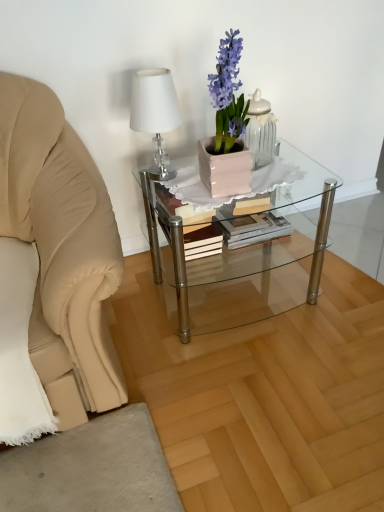
Locate an element on the screen. The image size is (384, 512). clear glass coffee table at center is located at coordinates click(245, 253).

The height and width of the screenshot is (512, 384). Describe the element at coordinates (235, 232) in the screenshot. I see `hardcover book at center` at that location.

What do you see at coordinates (261, 130) in the screenshot?
I see `white glossy jar at upper center` at bounding box center [261, 130].

In order to click on clear glass coffee table at center in this screenshot , I will do `click(245, 253)`.

Measure the distance between white glossy table lamp at upper left and clear glass coffee table at center.

white glossy table lamp at upper left and clear glass coffee table at center are 16.28 inches apart.

Which of these two, white glossy table lamp at upper left or clear glass coffee table at center, is wider?

Wider between the two is clear glass coffee table at center.

Does white glossy table lamp at upper left appear on the left side of clear glass coffee table at center?

Correct, you'll find white glossy table lamp at upper left to the left of clear glass coffee table at center.

At what (x,y) coordinates should I click in order to perform the action: click on coffee table behind the white glossy table lamp at upper left. Please return your answer as a coordinate pair (x, y). Looking at the image, I should click on (245, 253).

Is clear glass coffee table at center aimed at matte pink pot at center?

No, clear glass coffee table at center is not aimed at matte pink pot at center.

Which object is positioned more to the right, clear glass coffee table at center or matte pink pot at center?

Positioned to the right is clear glass coffee table at center.

Between clear glass coffee table at center and matte pink pot at center, which one has less height?

matte pink pot at center.

What's the angular difference between clear glass coffee table at center and matte pink pot at center's facing directions?

7.1 degrees separate the facing orientations of clear glass coffee table at center and matte pink pot at center.

Is clear glass coffee table at center located within white glossy jar at upper center?

No, clear glass coffee table at center is not surrounded by white glossy jar at upper center.

Is white glossy jar at upper center at the left side of clear glass coffee table at center?

No.

Is white glossy jar at upper center bigger than clear glass coffee table at center?

No, white glossy jar at upper center is not bigger than clear glass coffee table at center.

Does point (275, 130) lie behind point (159, 186)?

Yes, it is.

Considering the sizes of objects matte pink pot at center and white glossy jar at upper center in the image provided, who is shorter, matte pink pot at center or white glossy jar at upper center?

With less height is white glossy jar at upper center.

Which is nearer, (x=219, y=174) or (x=267, y=134)?

Point (x=219, y=174) is closer to the camera than point (x=267, y=134).

Looking at this image, does matte pink pot at center come in front of white glossy jar at upper center?

Yes, the depth of matte pink pot at center is less than that of white glossy jar at upper center.

Can we say matte pink pot at center lies outside white glossy jar at upper center?

That's correct, matte pink pot at center is outside of white glossy jar at upper center.

Which of these two, matte pink pot at center or white glossy table lamp at upper left, stands taller?

Standing taller between the two is matte pink pot at center.

Considering the positions of objects matte pink pot at center and white glossy table lamp at upper left in the image provided, who is in front, matte pink pot at center or white glossy table lamp at upper left?

matte pink pot at center is more forward.

Is matte pink pot at center not close to white glossy table lamp at upper left?

No, there isn't a large distance between matte pink pot at center and white glossy table lamp at upper left.

Can we say hardcover book at center lies outside matte pink pot at center?

That's correct, hardcover book at center is outside of matte pink pot at center.

Is hardcover book at center far from matte pink pot at center?

Actually, hardcover book at center and matte pink pot at center are a little close together.

Considering the sizes of objects hardcover book at center and matte pink pot at center in the image provided, who is bigger, hardcover book at center or matte pink pot at center?

matte pink pot at center.

Which is more to the right, white glossy jar at upper center or matte pink pot at center?

white glossy jar at upper center is more to the right.

Could matte pink pot at center be considered to be inside white glossy jar at upper center?

No, white glossy jar at upper center does not contain matte pink pot at center.

From a real-world perspective, who is located lower, white glossy jar at upper center or matte pink pot at center?

white glossy jar at upper center is physically lower.

Based on the photo, is white glossy jar at upper center smaller than matte pink pot at center?

Yes, white glossy jar at upper center is smaller than matte pink pot at center.

At what (x,y) coordinates should I click in order to perform the action: click on coffee table that appears below the white glossy table lamp at upper left (from a real-world perspective). Please return your answer as a coordinate pair (x, y). The width and height of the screenshot is (384, 512). Looking at the image, I should click on (245, 253).

Where is `houseplant positioned vertically above the clear glass coffee table at center (from a real-world perspective)`? The image size is (384, 512). houseplant positioned vertically above the clear glass coffee table at center (from a real-world perspective) is located at coordinates (227, 125).

Estimate the real-world distances between objects in this image. Which object is closer to white glossy table lamp at upper left, white glossy jar at upper center or hardcover book at center?

Based on the image, white glossy jar at upper center appears to be nearer to white glossy table lamp at upper left.

Looking at the image, which one is located further to clear glass coffee table at center, white glossy jar at upper center or hardcover book at center?

Among the two, white glossy jar at upper center is located further to clear glass coffee table at center.

Looking at the image, which one is located further to matte pink pot at center, white glossy jar at upper center or white glossy table lamp at upper left?

Among the two, white glossy table lamp at upper left is located further to matte pink pot at center.

When comparing their distances from white glossy jar at upper center, does white glossy table lamp at upper left or hardcover book at center seem closer?

Based on the image, hardcover book at center appears to be nearer to white glossy jar at upper center.

From the image, which object appears to be farther from hardcover book at center, white glossy jar at upper center or white glossy table lamp at upper left?

white glossy table lamp at upper left is further to hardcover book at center.

When comparing their distances from white glossy table lamp at upper left, does white glossy jar at upper center or clear glass coffee table at center seem further?

Among the two, clear glass coffee table at center is located further to white glossy table lamp at upper left.

Looking at the image, which one is located closer to white glossy jar at upper center, clear glass coffee table at center or hardcover book at center?

Based on the image, hardcover book at center appears to be nearer to white glossy jar at upper center.

When comparing their distances from clear glass coffee table at center, does white glossy table lamp at upper left or white glossy jar at upper center seem further?

white glossy table lamp at upper left is further to clear glass coffee table at center.

Find the location of a particular element. The width and height of the screenshot is (384, 512). houseplant situated between white glossy table lamp at upper left and white glossy jar at upper center from left to right is located at coordinates (227, 125).

I want to click on book between white glossy table lamp at upper left and clear glass coffee table at center in the vertical direction, so click(x=235, y=232).

You are a GUI agent. You are given a task and a screenshot of the screen. Output one action in this format:
    pyautogui.click(x=<x>, y=<y>)
    Task: Click on the tableware between matte pink pot at center and hardcover book at center from front to back
    The image size is (384, 512).
    Given the screenshot: What is the action you would take?
    pyautogui.click(x=261, y=130)

Identify the location of book between white glossy jar at upper center and clear glass coffee table at center from top to bottom. The image size is (384, 512). (235, 232).